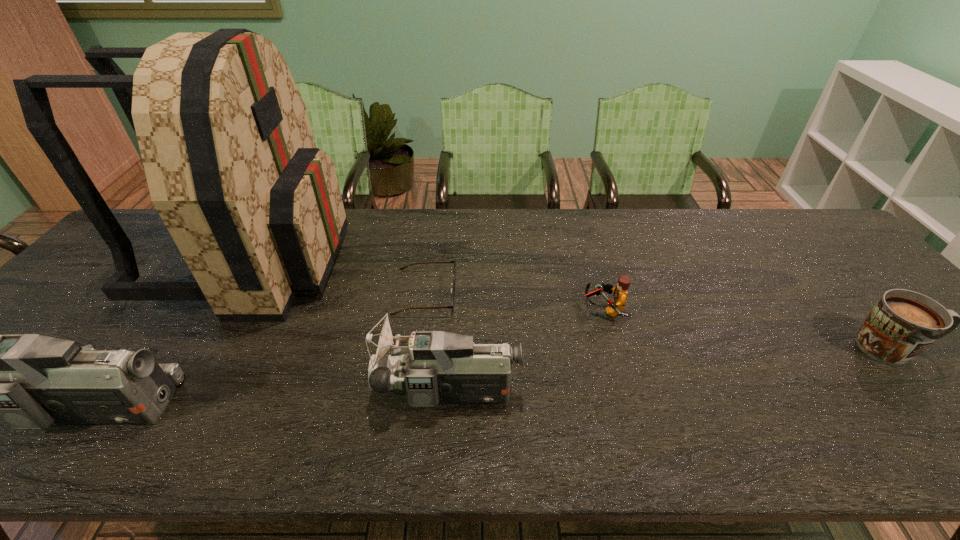
Find the location of a particular element. free location located 0.050m holding a crossbow in the hands of the Lego is located at coordinates (564, 309).

Identify the location of free space located holding a crossbow in the hands of the Lego. The width and height of the screenshot is (960, 540). (468, 309).

This screenshot has height=540, width=960. In order to click on vacant space situated holding a crossbow in the hands of the Lego in this screenshot , I will do `click(530, 309)`.

This screenshot has width=960, height=540. Find the location of `blank area located on the front-facing side of the spectacles`. blank area located on the front-facing side of the spectacles is located at coordinates (529, 293).

Where is `object that is at the far edge`? object that is at the far edge is located at coordinates (255, 209).

In order to click on object at the near edge in this screenshot , I will do `click(440, 367)`.

Where is `object at the right edge`? The image size is (960, 540). object at the right edge is located at coordinates (902, 324).

In order to click on blank space at the far edge of the desktop in this screenshot , I will do `click(588, 240)`.

Where is `free space at the near edge of the desktop`? Image resolution: width=960 pixels, height=540 pixels. free space at the near edge of the desktop is located at coordinates (816, 414).

This screenshot has width=960, height=540. Find the location of `vacant space at the left edge of the desktop`. vacant space at the left edge of the desktop is located at coordinates (74, 305).